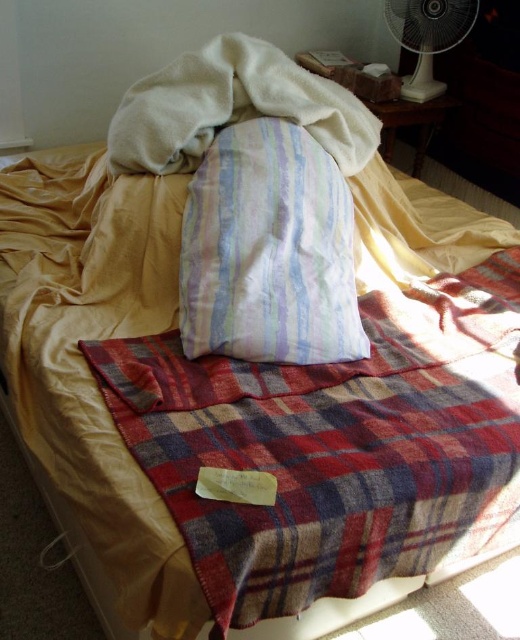
Question: Which object is the farthest from the white plastic fan at upper right?

Choices:
 (A) white soft towel at upper center
 (B) striped fabric pillow at center

Answer: (B)

Question: Which of the following is the closest to the observer?

Choices:
 (A) (151, 138)
 (B) (426, 13)
 (C) (274, 259)

Answer: (C)

Question: Does striped fabric pillow at center have a lesser width compared to white soft towel at upper center?

Choices:
 (A) no
 (B) yes

Answer: (B)

Question: Among these objects, which one is farthest from the camera?

Choices:
 (A) striped fabric pillow at center
 (B) white plastic fan at upper right

Answer: (B)

Question: Is striped fabric pillow at center further to the viewer compared to white plastic fan at upper right?

Choices:
 (A) no
 (B) yes

Answer: (A)

Question: Can you confirm if white soft towel at upper center is positioned to the right of white plastic fan at upper right?

Choices:
 (A) yes
 (B) no

Answer: (B)